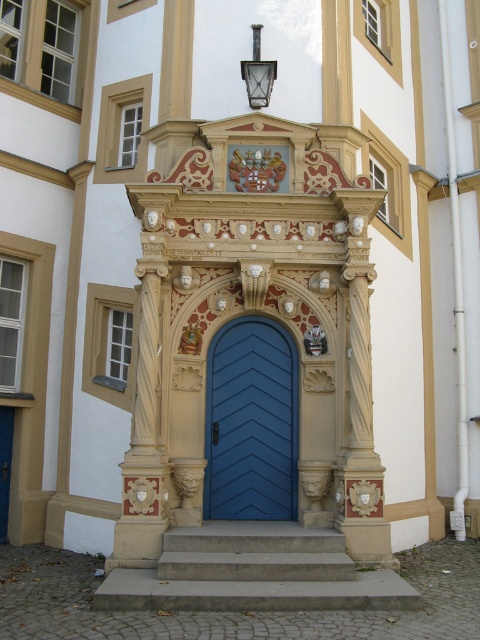
Question: Among these points, which one is nearest to the camera?

Choices:
 (A) (294, 364)
 (B) (254, 524)

Answer: (B)

Question: Is concrete steps at center closer to the viewer compared to blue wooden door at center?

Choices:
 (A) no
 (B) yes

Answer: (B)

Question: Which object is farther from the camera taking this photo?

Choices:
 (A) blue wooden door at center
 (B) concrete steps at center

Answer: (A)

Question: Does concrete steps at center appear over blue wooden door at center?

Choices:
 (A) no
 (B) yes

Answer: (A)

Question: Is concrete steps at center to the left of blue wooden door at center from the viewer's perspective?

Choices:
 (A) yes
 (B) no

Answer: (A)